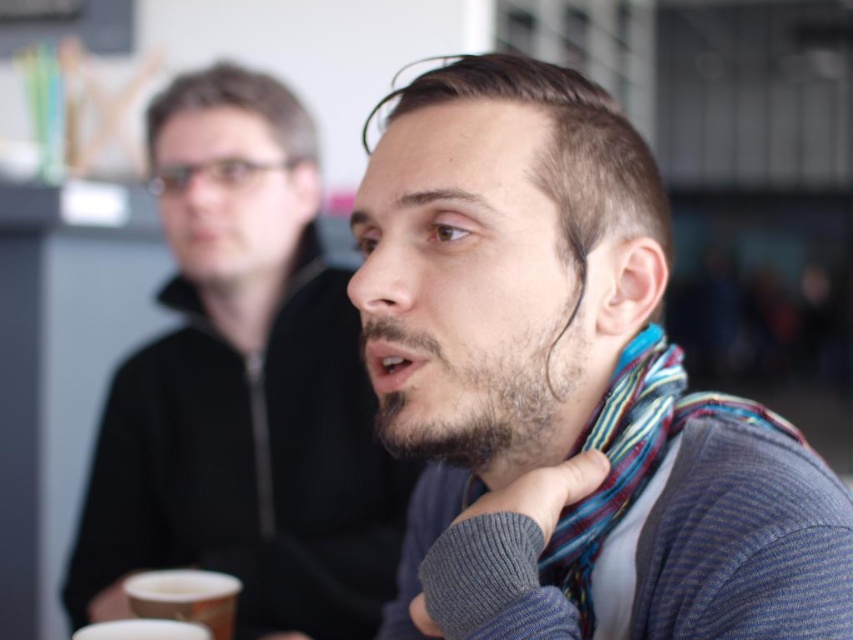
You are organizing a charity event and need to display two scarves in a showcase. The showcase has two slots with different widths. The first slot can accommodate items up to 30 cm wide, and the second slot can hold items up to 40 cm wide. Given the description of the striped scarf at center and the striped fabric scarf at center, which scarf should go into each slot to ensure they fit properly?

The striped scarf at center has a larger width than the striped fabric scarf at center. Since the first slot can hold up to 30 cm and the second up to 40 cm, the striped fabric scarf at center should go into the first slot if it is under 30 cm, and the striped scarf at center should go into the second slot if it is under 40 cm. However, without exact measurements, we can only infer based on the given comparison. Since the striped scarf is wider, it needs the larger slot. If the striped fabric scarf is under

You are a delivery robot with a 12 inch wide package. You need to move from the entrance to the desk where the white paper cup at lower left is placed. There is an obstacle in the path, the striped fabric scarf at center. Can you navigate around it without hitting the package?

The distance between the striped fabric scarf at center and the white paper cup at lower left is 15.09 inches. Since your package is 12 inches wide, there is enough space to navigate around the obstacle as 15.09 inches is greater than 12 inches.

You are standing in the office scene described. You need to place a small plant exactly at point (x=244, y=387). Will the plant be placed on the matte black jacket at center?

Yes, the plant will be placed on the matte black jacket at center because the description states that at point (x=244, y=387) lies the matte black jacket at center.